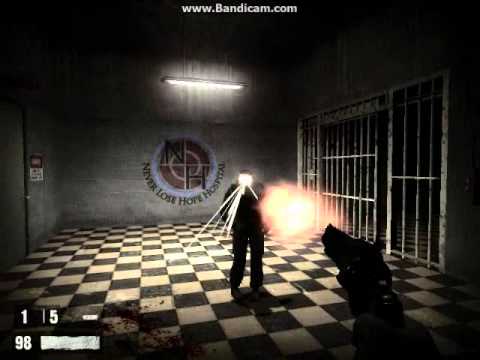
Locate an element on the screen. This screenshot has width=480, height=360. light is located at coordinates (203, 83).